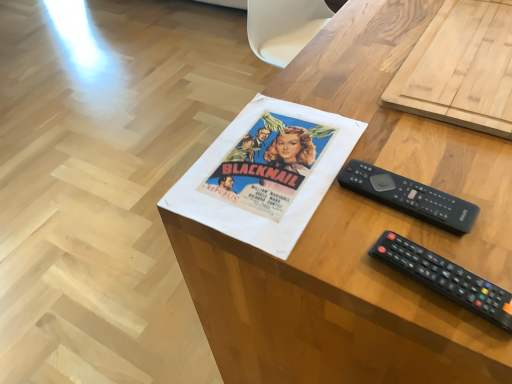
You are a GUI agent. You are given a task and a screenshot of the screen. Output one action in this format:
    pyautogui.click(x=<x>, y=<y>)
    Task: Click on the vacant space behind black plastic remote at lower right, which is the second remote control in top-to-bottom order
    This screenshot has height=384, width=512.
    Given the screenshot: What is the action you would take?
    click(396, 185)